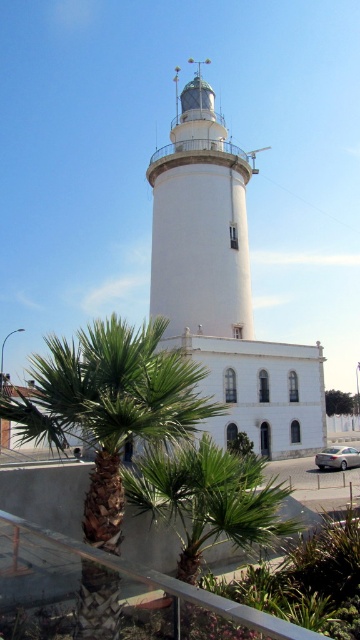
In the scene shown: You are standing at the center of the image and want to walk directly towards the white smooth lighthouse at center. Which direction should you head?

Since the white smooth lighthouse at center is already at the center of the image, you are already facing the correct direction. There is no need to change your heading as you are directly in front of it.

You are standing at the base of the lighthouse and want to take a photo of the lighthouse with both the green leafy palm at lower center and the green leafy tree at lower center in the frame. Which of the two plants should you position closer to the camera to ensure both are visible in the photo?

To ensure both the green leafy palm at lower center and the green leafy tree at lower center are visible in the photo, you should position the green leafy palm at lower center closer to the camera. Since the green leafy palm is positioned over the green leafy tree, placing the palm closer would allow both to be in the frame without one blocking the other.